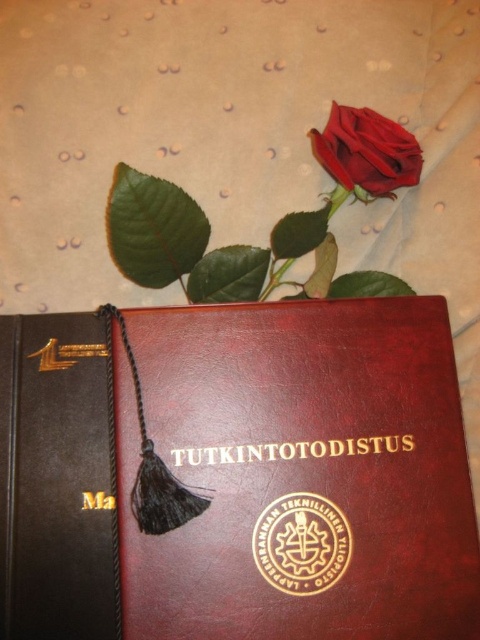
You are holding a camera and want to take a photo of both the brown leather book at center and the matte red rose at upper center. Which object should you focus on first to ensure both are in clear view?

The brown leather book at center is closer to the viewer than the matte red rose at upper center, so focus on the brown leather book at center first to ensure both are in clear view.

You are a student who just received your diploma and want to place it on the textured surface. You notice two points marked on the surface. The first point is at coordinates point (144, 609) and the second is at point (409, 132). If you want to place the diploma closer to you, which point should you choose?

Point (144, 609) is in front of point (409, 132), so you should choose point (144, 609) to place the diploma closer to you.

You are a robot with a camera that can detect objects in 2D coordinates. You need to locate the brown leather book at center. What are its coordinates?

The brown leather book at center is located at coordinates (238, 474).